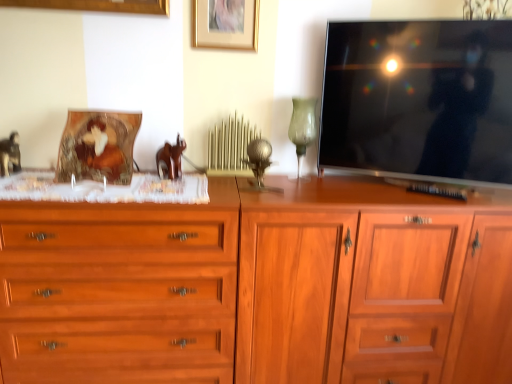
Question: Can metallic silver table lamp at center, marked as the first table lamp in a left-to-right arrangement, be found inside brown wooden horse at center?

Choices:
 (A) yes
 (B) no

Answer: (B)

Question: Considering the relative positions of brown wooden horse at center and metallic silver table lamp at center, placed as the second table lamp when sorted from right to left, in the image provided, is brown wooden horse at center in front of metallic silver table lamp at center, placed as the second table lamp when sorted from right to left,?

Choices:
 (A) yes
 (B) no

Answer: (B)

Question: From a real-world perspective, is brown wooden horse at center on metallic silver table lamp at center, placed as the second table lamp when sorted from right to left?

Choices:
 (A) yes
 (B) no

Answer: (B)

Question: Is brown wooden horse at center completely or partially outside of metallic silver table lamp at center, placed as the second table lamp when sorted from right to left?

Choices:
 (A) yes
 (B) no

Answer: (A)

Question: Is brown wooden horse at center at the right side of metallic silver table lamp at center, placed as the second table lamp when sorted from right to left?

Choices:
 (A) yes
 (B) no

Answer: (B)

Question: Is brown wooden horse at center turned away from metallic silver table lamp at center, marked as the first table lamp in a left-to-right arrangement?

Choices:
 (A) yes
 (B) no

Answer: (B)

Question: Does matte black tv at upper right have a lesser height compared to wooden cabinet at center, the 2th chest of drawers from the left?

Choices:
 (A) yes
 (B) no

Answer: (A)

Question: Does matte black tv at upper right come behind wooden cabinet at center, the 2th chest of drawers from the left?

Choices:
 (A) yes
 (B) no

Answer: (B)

Question: Is matte black tv at upper right closer to camera compared to wooden cabinet at center, which is the first chest of drawers in right-to-left order?

Choices:
 (A) yes
 (B) no

Answer: (A)

Question: Is matte black tv at upper right in contact with wooden cabinet at center, the 2th chest of drawers from the left?

Choices:
 (A) yes
 (B) no

Answer: (B)

Question: From a real-world perspective, is matte black tv at upper right on wooden cabinet at center, the 2th chest of drawers from the left?

Choices:
 (A) yes
 (B) no

Answer: (A)

Question: From a real-world perspective, does matte black tv at upper right sit lower than wooden cabinet at center, which is the first chest of drawers in right-to-left order?

Choices:
 (A) no
 (B) yes

Answer: (A)

Question: Is green glass vase at upper center, placed as the 1th table lamp when sorted from right to left, at the left side of matte black tv at upper right?

Choices:
 (A) no
 (B) yes

Answer: (B)